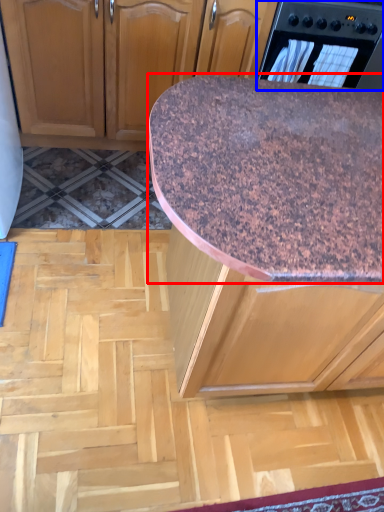
Question: Which point is further to the camera, countertop (highlighted by a red box) or home appliance (highlighted by a blue box)?

Choices:
 (A) countertop
 (B) home appliance

Answer: (B)